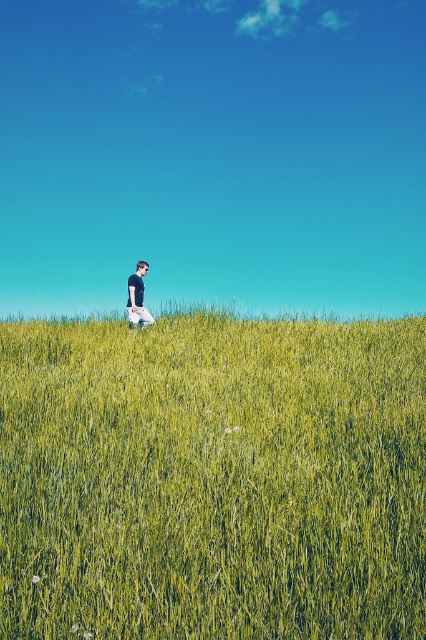
Question: Is green grassy field at center above matte black t-shirt at center?

Choices:
 (A) no
 (B) yes

Answer: (A)

Question: Which point appears closest to the camera in this image?

Choices:
 (A) (132, 280)
 (B) (400, 497)

Answer: (B)

Question: Which point appears farthest from the camera in this image?

Choices:
 (A) 382,605
 (B) 141,275

Answer: (B)

Question: Is green grassy field at center below matte black t-shirt at center?

Choices:
 (A) no
 (B) yes

Answer: (B)

Question: Is green grassy field at center to the right of matte black t-shirt at center from the viewer's perspective?

Choices:
 (A) yes
 (B) no

Answer: (A)

Question: Among these points, which one is farthest from the camera?

Choices:
 (A) (138, 266)
 (B) (164, 323)

Answer: (A)